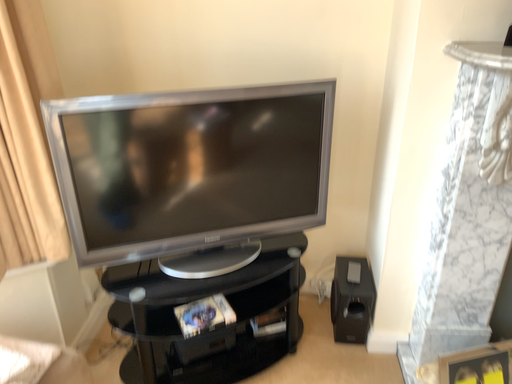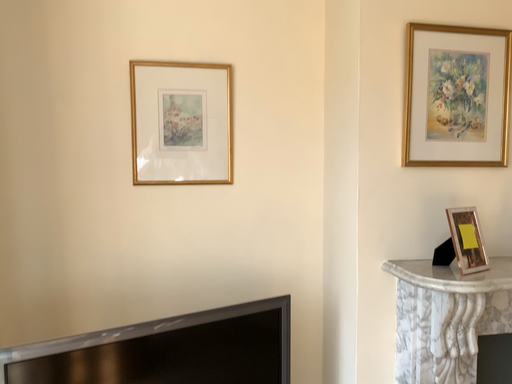
Question: How did the camera likely rotate when shooting the video?

Choices:
 (A) rotated right
 (B) rotated left

Answer: (A)